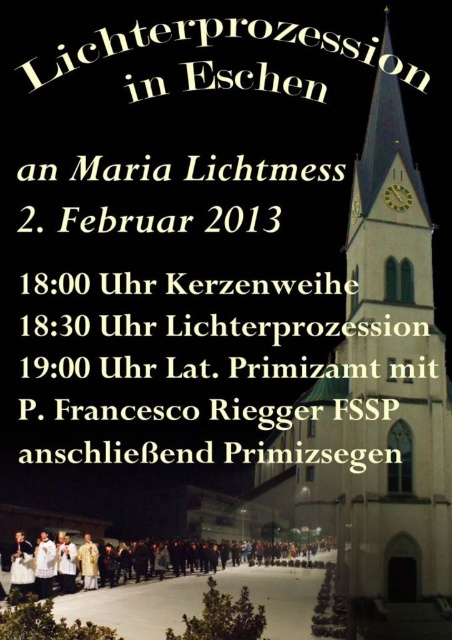
Is white stone church at center further to camera compared to white satin dress at lower center?

No, it is in front of white satin dress at lower center.

Which of these two, white stone church at center or white satin dress at lower center, stands taller?

white stone church at center

Which is behind, point (433, 497) or point (28, 592)?

Point (28, 592)

Image resolution: width=452 pixels, height=640 pixels. In order to click on white stone church at center in this screenshot , I will do point(373,400).

Who is more forward, (320, 440) or (81, 548)?

Point (320, 440)

Which is behind, point (368, 125) or point (86, 540)?

The point (368, 125) is behind.

Identify the location of white stone church at center. (373, 400).

Which is more to the left, white stone church at center or white clothed people at center?

From the viewer's perspective, white clothed people at center appears more on the left side.

Who is shorter, white stone church at center or white clothed people at center?

With less height is white clothed people at center.

Where is `white stone church at center`? This screenshot has height=640, width=452. white stone church at center is located at coordinates (373, 400).